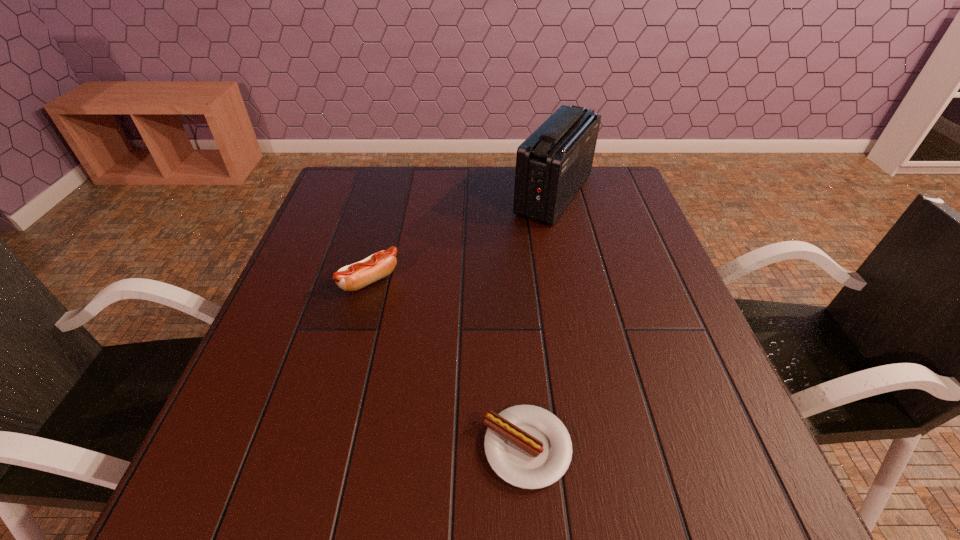
Find the location of a particular element. This screenshot has width=960, height=540. free region located 0.170m on the back of the nearer sausage is located at coordinates (517, 336).

Where is `object situated at the far edge`? This screenshot has width=960, height=540. object situated at the far edge is located at coordinates (552, 164).

Where is `object that is at the near edge`? The height and width of the screenshot is (540, 960). object that is at the near edge is located at coordinates (527, 446).

At what (x,y) coordinates should I click in order to perform the action: click on object that is at the left edge. Please return your answer as a coordinate pair (x, y). This screenshot has height=540, width=960. Looking at the image, I should click on (353, 277).

Find the location of a particular element. The height and width of the screenshot is (540, 960). object that is at the right edge is located at coordinates (552, 164).

This screenshot has width=960, height=540. In order to click on object at the far right corner in this screenshot , I will do `click(552, 164)`.

The image size is (960, 540). I want to click on vacant space at the far edge, so click(x=426, y=192).

Where is `vacant region at the near edge of the desktop`? This screenshot has width=960, height=540. vacant region at the near edge of the desktop is located at coordinates (625, 509).

What are the coordinates of `vacant area at the left edge of the desktop` in the screenshot? It's located at (232, 446).

In the image, there is a desktop. Where is `free space at the right edge`? This screenshot has width=960, height=540. free space at the right edge is located at coordinates (590, 220).